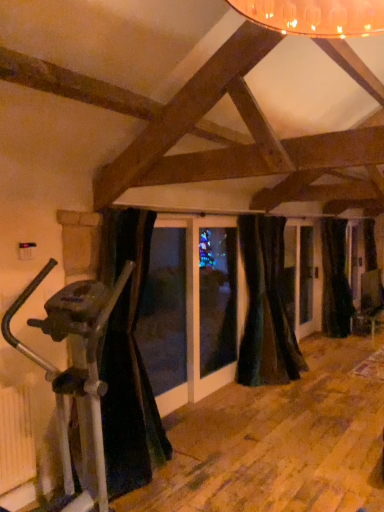
Question: In terms of size, does black velvet curtain at left, which appears as the third curtain when viewed from the right, appear bigger or smaller than black velvet curtain at right, which is the 3th curtain from left to right?

Choices:
 (A) big
 (B) small

Answer: (A)

Question: Visually, is black velvet curtain at left, marked as the 1th curtain in a front-to-back arrangement, positioned to the left or to the right of black velvet curtain at right, which is the 3th curtain from left to right?

Choices:
 (A) left
 (B) right

Answer: (A)

Question: Which of these objects is positioned farthest from the silver metallic stationary bicycle at left?

Choices:
 (A) black velvet curtain at right, the 1th curtain positioned from the back
 (B) velvet dark green curtain at center, positioned as the 2th curtain in right-to-left order
 (C) black velvet curtain at left, marked as the third curtain in a back-to-front arrangement

Answer: (A)

Question: Estimate the real-world distances between objects in this image. Which object is farther from the velvet dark green curtain at center, the 2th curtain when ordered from front to back?

Choices:
 (A) silver metallic stationary bicycle at left
 (B) black velvet curtain at left, the 1th curtain from the left
 (C) black velvet curtain at right, acting as the third curtain starting from the front

Answer: (A)